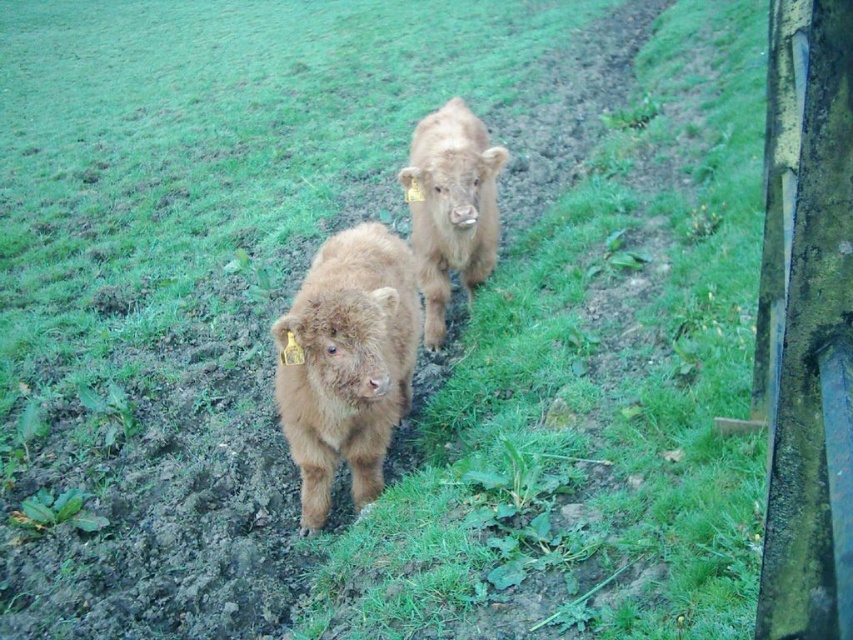
Who is lower down, fuzzy brown calf at center or brown furry calf at center?

fuzzy brown calf at center is below.

This screenshot has height=640, width=853. What do you see at coordinates (347, 364) in the screenshot?
I see `fuzzy brown calf at center` at bounding box center [347, 364].

The height and width of the screenshot is (640, 853). What do you see at coordinates (347, 364) in the screenshot?
I see `fuzzy brown calf at center` at bounding box center [347, 364].

Image resolution: width=853 pixels, height=640 pixels. I want to click on fuzzy brown calf at center, so click(347, 364).